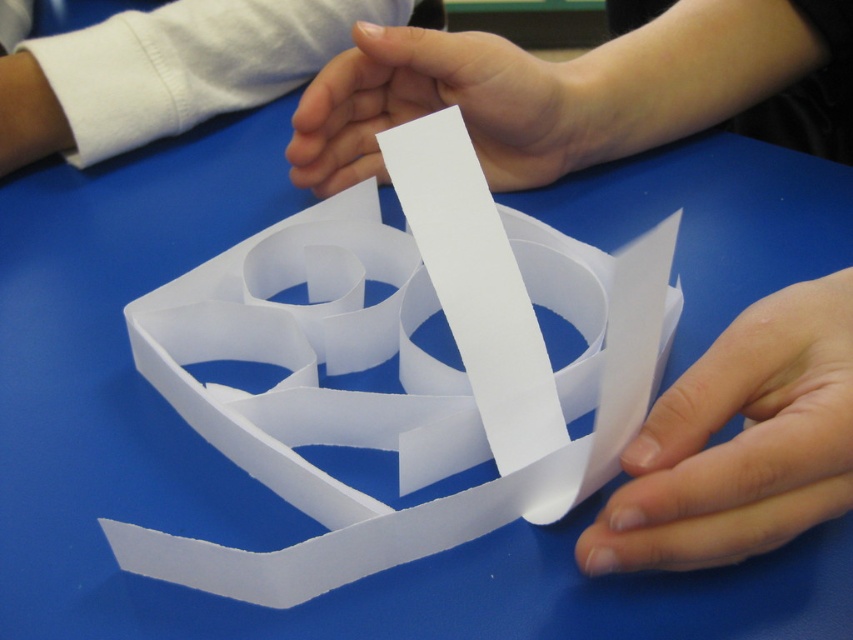
Does white paper at upper center have a larger size compared to white clothed arm at upper left?

Actually, white paper at upper center might be smaller than white clothed arm at upper left.

Which is more to the right, white paper at upper center or white clothed arm at upper left?

Positioned to the right is white paper at upper center.

Which is behind, point (585, 76) or point (192, 77)?

Point (192, 77)

Image resolution: width=853 pixels, height=640 pixels. I want to click on white paper at upper center, so click(x=553, y=90).

Who is taller, smooth white finger at center or white clothed arm at upper left?

With more height is white clothed arm at upper left.

Based on the photo, between smooth white finger at center and white clothed arm at upper left, which one appears on the right side from the viewer's perspective?

smooth white finger at center is more to the right.

Identify the location of smooth white finger at center. (740, 442).

Identify the location of smooth white finger at center. This screenshot has width=853, height=640. click(x=740, y=442).

Which is in front, point (84, 100) or point (444, 61)?

Positioned in front is point (444, 61).

From the picture: Which is above, white clothed arm at upper left or white paper at center?

white clothed arm at upper left is above.

What do you see at coordinates (161, 68) in the screenshot? I see `white clothed arm at upper left` at bounding box center [161, 68].

Locate an element on the screen. white clothed arm at upper left is located at coordinates (161, 68).